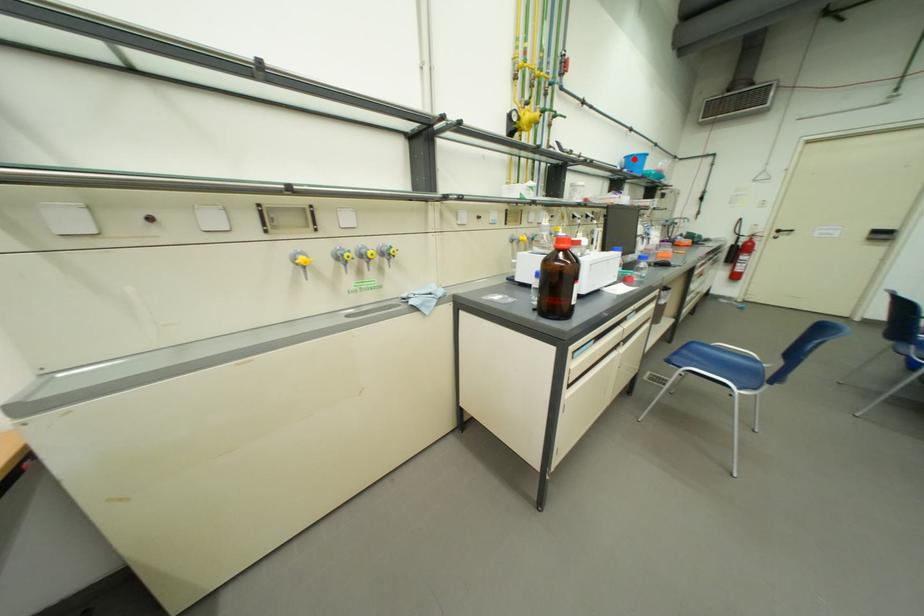
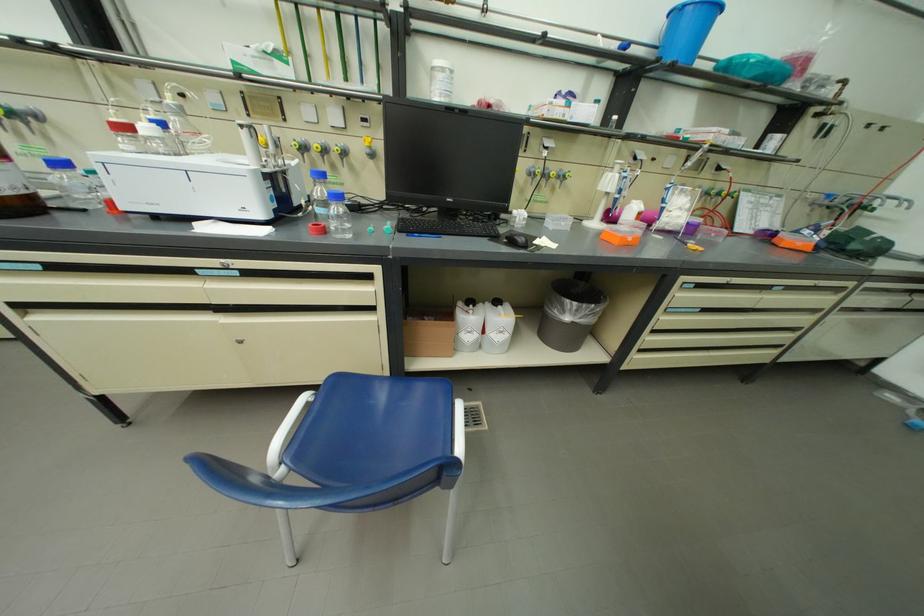
Find the pixel in the second image that matches the highlighted location in the first image.

(677, 20)